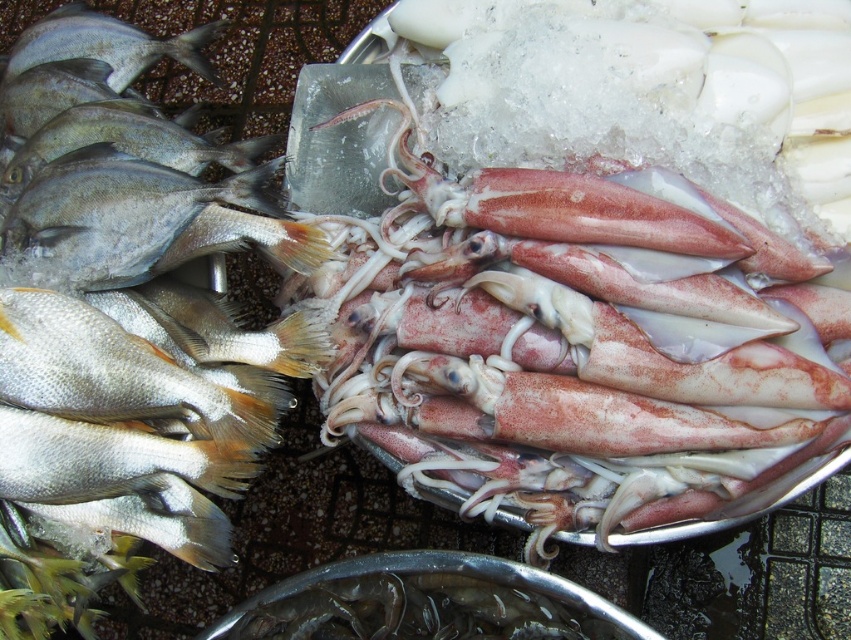
Question: Among these points, which one is farthest from the camera?

Choices:
 (A) (89, 22)
 (B) (75, 248)

Answer: (A)

Question: Does silver shiny fish at left appear under shiny silver fish at left?

Choices:
 (A) yes
 (B) no

Answer: (A)

Question: Which of the following is the farthest from the observer?

Choices:
 (A) shiny silver fish at left
 (B) silver shiny fish at left

Answer: (A)

Question: Is silver shiny fish at left closer to the viewer compared to shiny silver fish at left?

Choices:
 (A) yes
 (B) no

Answer: (A)

Question: Which point is farther to the camera?

Choices:
 (A) silver shiny fish at left
 (B) shiny silver fish at left

Answer: (B)

Question: Does silver shiny fish at left lie in front of shiny silver fish at left?

Choices:
 (A) no
 (B) yes

Answer: (B)